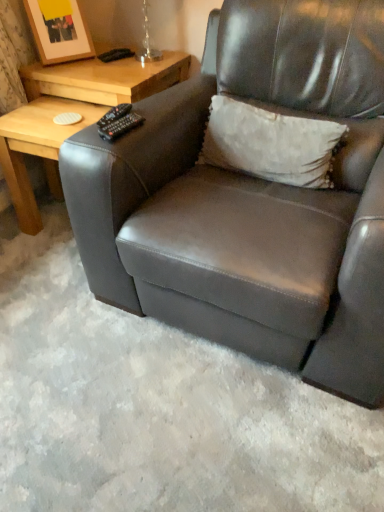
Question: Is white textured pillow at upper center wider or thinner than matte black armchair at center?

Choices:
 (A) wide
 (B) thin

Answer: (B)

Question: Which is correct: white textured pillow at upper center is inside matte black armchair at center, or outside of it?

Choices:
 (A) outside
 (B) inside

Answer: (B)

Question: Considering the real-world distances, which object is closest to the black plastic remote at upper left?

Choices:
 (A) white textured pillow at upper center
 (B) matte black armchair at center
 (C) wooden picture frame at upper left
 (D) light wood table at left, which is counted as the 1th table, starting from the bottom
 (E) light brown wood table at upper left, the 2th table in the bottom-to-top sequence

Answer: (A)

Question: Which of these objects is positioned closest to the black plastic remote at upper left?

Choices:
 (A) wooden picture frame at upper left
 (B) light brown wood table at upper left, the 2th table in the bottom-to-top sequence
 (C) matte black armchair at center
 (D) light wood table at left, placed as the 2th table when sorted from top to bottom
 (E) white textured pillow at upper center

Answer: (E)